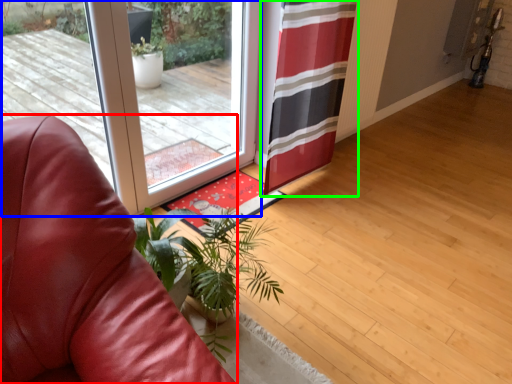
Question: Which is nearer to the chair (highlighted by a red box)? door (highlighted by a blue box) or curtain (highlighted by a green box).

Choices:
 (A) door
 (B) curtain

Answer: (A)